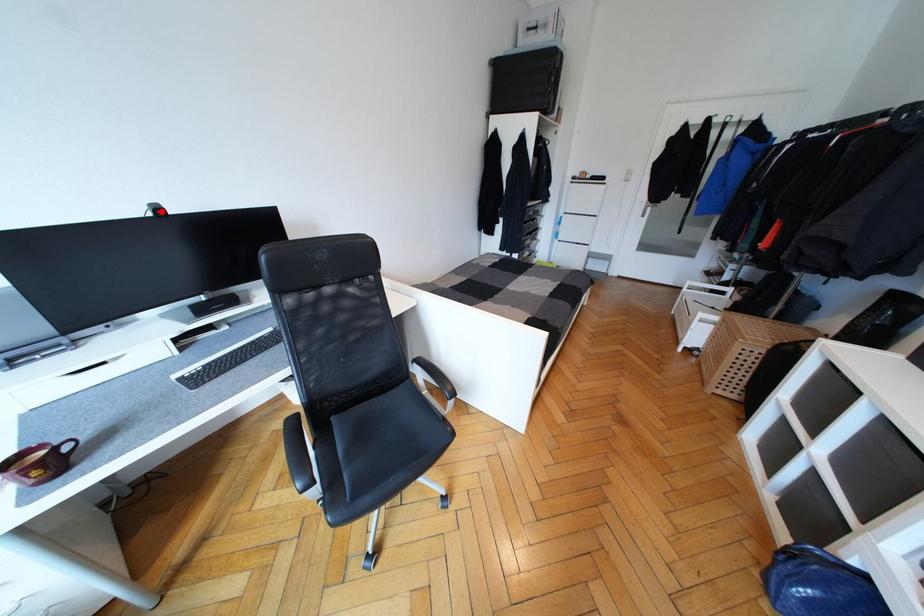
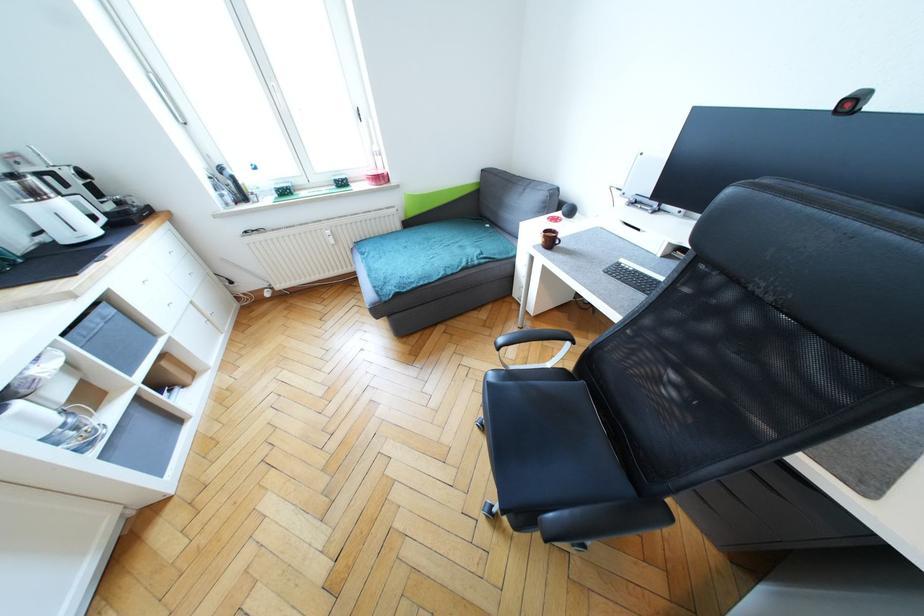
Where in the second image is the point corresponding to the highlighted location from the first image?

(857, 103)